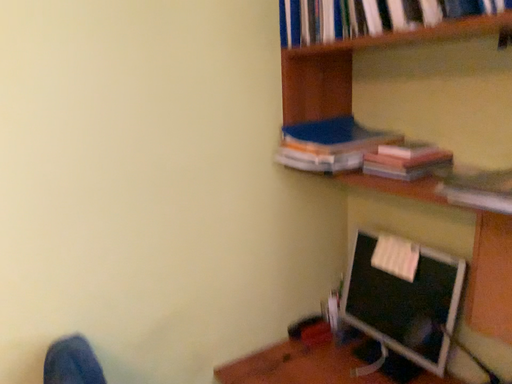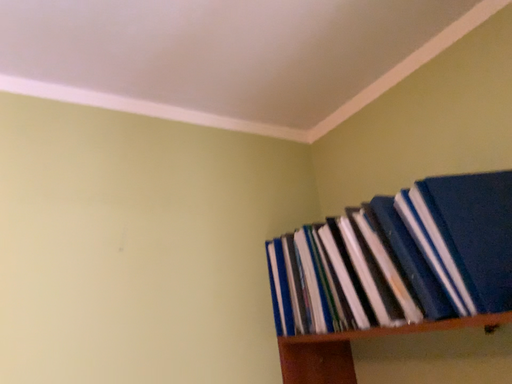
Question: Which way did the camera rotate in the video?

Choices:
 (A) rotated downward
 (B) rotated upward

Answer: (B)